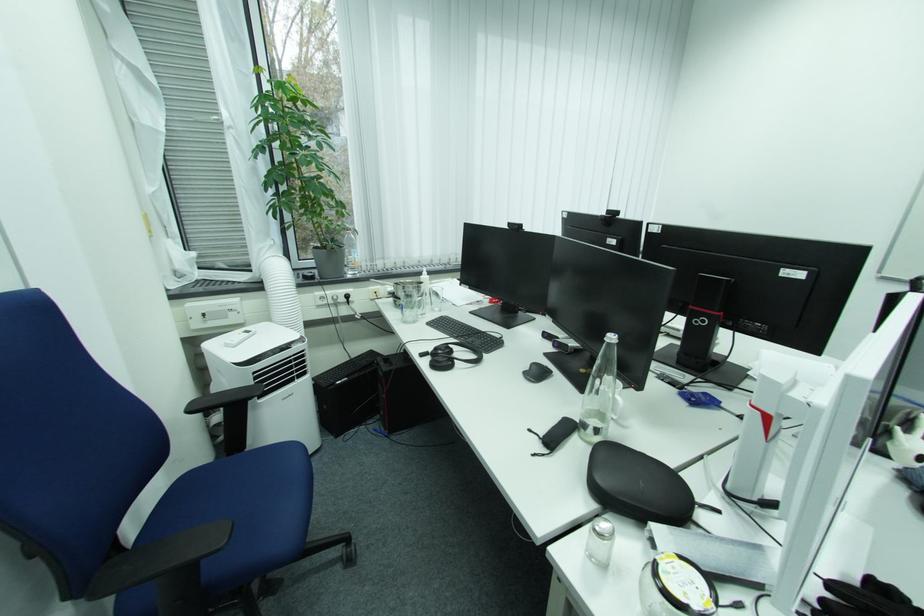
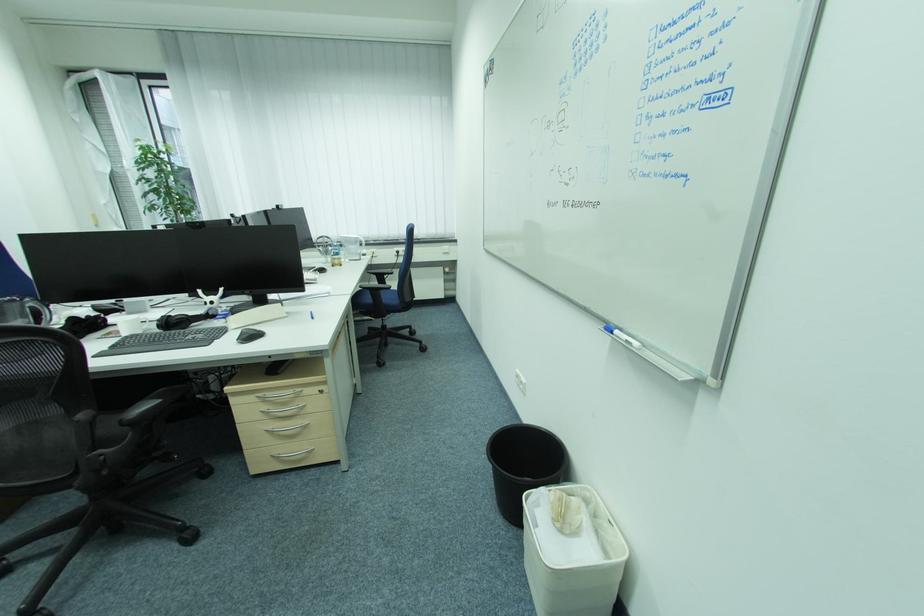
Question: Which direction would the cameraman need to move to produce the second image? Reply with the corresponding letter.

Choices:
 (A) Left
 (B) Right
 (C) Forward
 (D) Backward

Answer: (B)